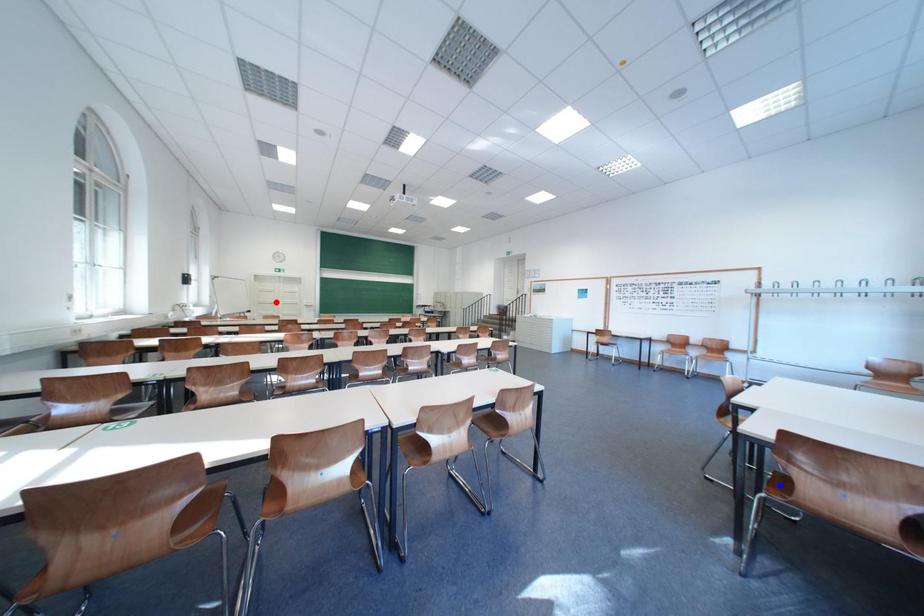
Question: Two points are marked on the image. Which point is closer to the camera?

Choices:
 (A) Blue point is closer.
 (B) Red point is closer.

Answer: (A)